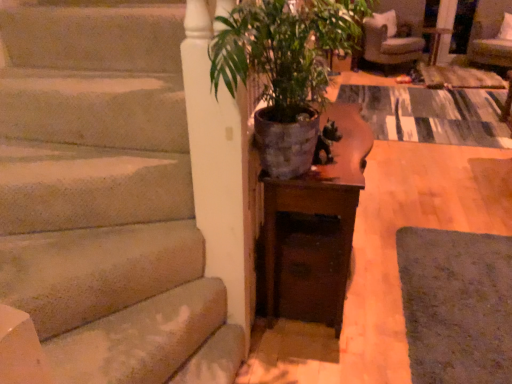
What are the coordinates of `vacant area that lies to the right of wooden table at center` in the screenshot? It's located at (391, 253).